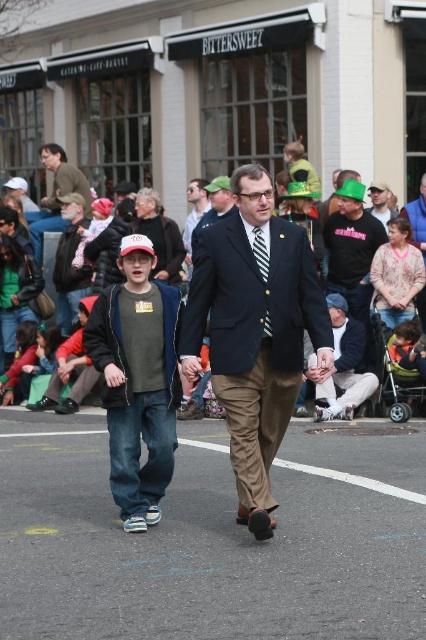
Who is higher up, denim jeans at center or matte black suit at center?

matte black suit at center is above.

Which is behind, point (115, 364) or point (362, 259)?

Positioned behind is point (362, 259).

Locate an element on the screen. This screenshot has width=426, height=640. denim jeans at center is located at coordinates (138, 380).

Which is below, matte black suit at center or black matte shirt at center?

black matte shirt at center is lower down.

Who is more forward, (328, 241) or (356, 301)?

Positioned in front is point (356, 301).

Where is `matte black suit at center`? The width and height of the screenshot is (426, 640). matte black suit at center is located at coordinates (337, 237).

Locate an element on the screen. Image resolution: width=426 pixels, height=640 pixels. matte black suit at center is located at coordinates (337, 237).

The image size is (426, 640). What do you see at coordinates (138, 380) in the screenshot? I see `denim jeans at center` at bounding box center [138, 380].

Between denim jeans at center and green felt hat at center, which one has less height?

With less height is green felt hat at center.

Consider the image. Measure the distance between point (176, 291) and camera.

Point (176, 291) and camera are 23.00 feet apart.

In order to click on denim jeans at center in this screenshot , I will do `click(138, 380)`.